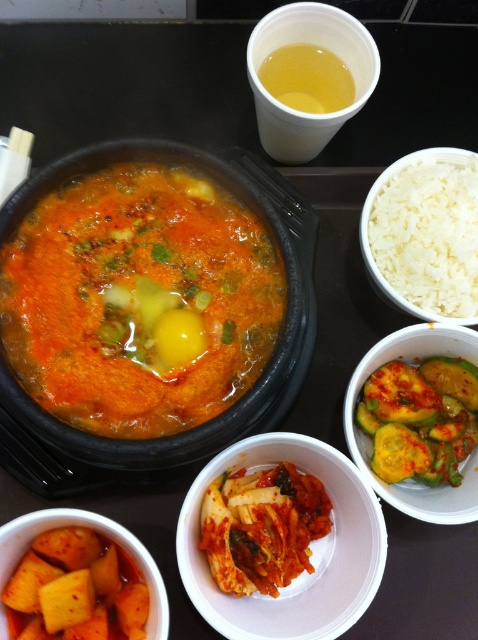
Question: Is tomato-colored broth at center thinner than white polished rice at upper right?

Choices:
 (A) yes
 (B) no

Answer: (B)

Question: Which point is farther from the camera taking this photo?

Choices:
 (A) (216, 572)
 (B) (325, 44)
 (C) (426, 429)
 (D) (377, 547)

Answer: (B)

Question: Does white polished rice at upper right appear over translucent plastic cup at upper center?

Choices:
 (A) no
 (B) yes

Answer: (A)

Question: Which object is farther from the camera taking this photo?

Choices:
 (A) bright red kimchi at center
 (B) translucent yellow liquid at upper center
 (C) white polished rice at upper right
 (D) green pickled cucumber at lower right

Answer: (B)

Question: Does white polished rice at upper right appear over translucent yellow liquid at upper center?

Choices:
 (A) yes
 (B) no

Answer: (B)

Question: Among these objects, which one is farthest from the camera?

Choices:
 (A) tomato-colored broth at center
 (B) translucent yellow liquid at upper center

Answer: (B)